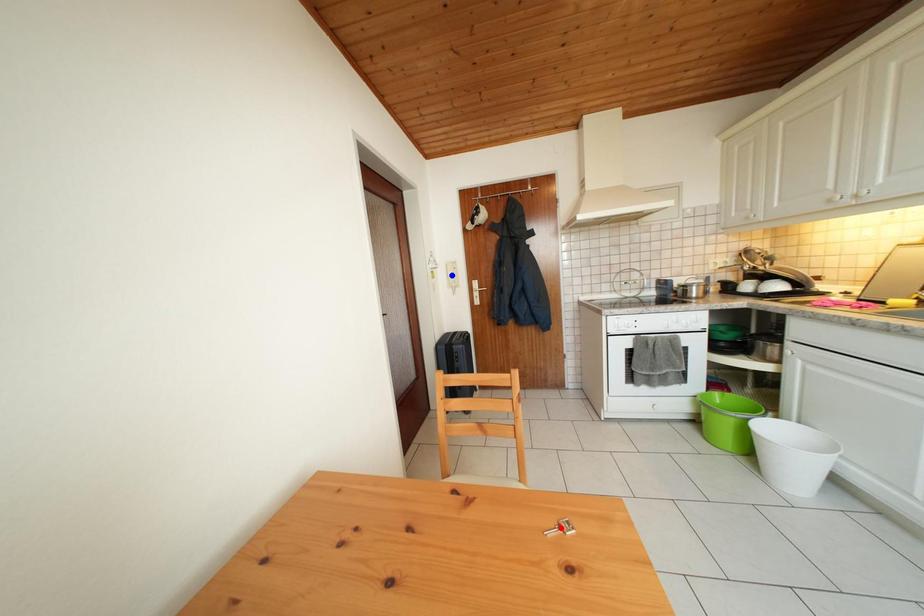
Question: In the image, two points are highlighted. Which point is nearer to the camera? Reply with the corresponding letter.

Choices:
 (A) blue point
 (B) red point

Answer: (B)